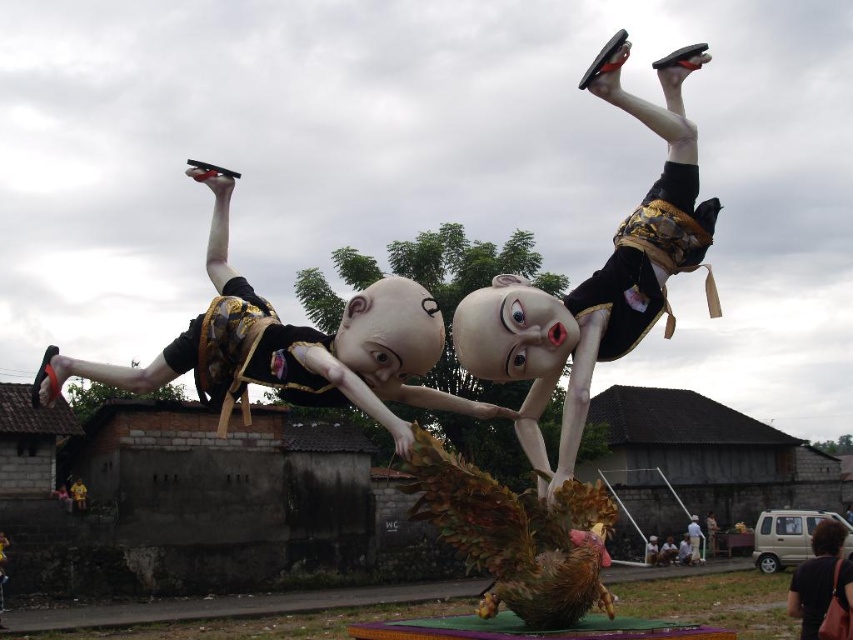
Who is shorter, brown leather hair at lower right or white matte person at center?

With less height is white matte person at center.

Where is `brown leather hair at lower right`? This screenshot has width=853, height=640. brown leather hair at lower right is located at coordinates (822, 586).

Is point (811, 588) less distant than point (692, 561)?

That is True.

The height and width of the screenshot is (640, 853). I want to click on brown leather hair at lower right, so click(x=822, y=586).

Between point (236, 292) and point (689, 548), which one is positioned behind?

The point (689, 548) is more distant.

Between point (221, 240) and point (703, 557), which one is positioned in front?

Point (221, 240)

This screenshot has width=853, height=640. Describe the element at coordinates (288, 346) in the screenshot. I see `matte black figure at left` at that location.

Image resolution: width=853 pixels, height=640 pixels. What are the coordinates of `matte black figure at left` in the screenshot? It's located at pyautogui.click(x=288, y=346).

Who is taller, matte black figure at left or matte black figure at center?

Standing taller between the two is matte black figure at left.

Measure the distance between point [460,401] and camera.

Point [460,401] is 37.24 meters away from camera.

Where is `matte black figure at left`? matte black figure at left is located at coordinates (288, 346).

Locate an element on the screen. The image size is (853, 640). matte black figure at left is located at coordinates (288, 346).